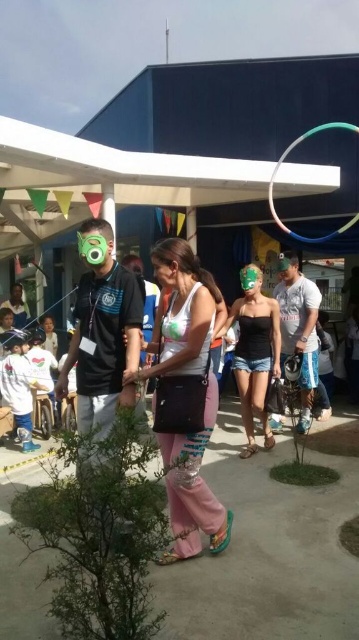
Is matte green mask at center thinner than green rubber hula hoop at upper center?

Correct, matte green mask at center's width is less than green rubber hula hoop at upper center's.

Can you confirm if matte green mask at center is positioned to the right of green rubber hula hoop at upper center?

No, matte green mask at center is not to the right of green rubber hula hoop at upper center.

Measure the distance between matte green mask at center and camera.

matte green mask at center is 13.60 feet from camera.

This screenshot has height=640, width=359. Find the location of `matte green mask at center`. matte green mask at center is located at coordinates (254, 353).

Can you confirm if pink fabric pants at center is positioned above green rubber hula hoop at upper center?

No, pink fabric pants at center is not above green rubber hula hoop at upper center.

Who is higher up, pink fabric pants at center or green rubber hula hoop at upper center?

green rubber hula hoop at upper center

This screenshot has width=359, height=640. In order to click on pink fabric pants at center in this screenshot , I will do `click(185, 397)`.

Which is above, pink fabric pants at center or matte green mask at center?

matte green mask at center is higher up.

Is pink fabric pants at center below matte green mask at center?

Indeed, pink fabric pants at center is positioned under matte green mask at center.

Between point (193, 481) and point (274, 365), which one is positioned behind?

The point (274, 365) is behind.

At what (x,y) coordinates should I click in order to perform the action: click on pink fabric pants at center. Please return your answer as a coordinate pair (x, y). Looking at the image, I should click on (185, 397).